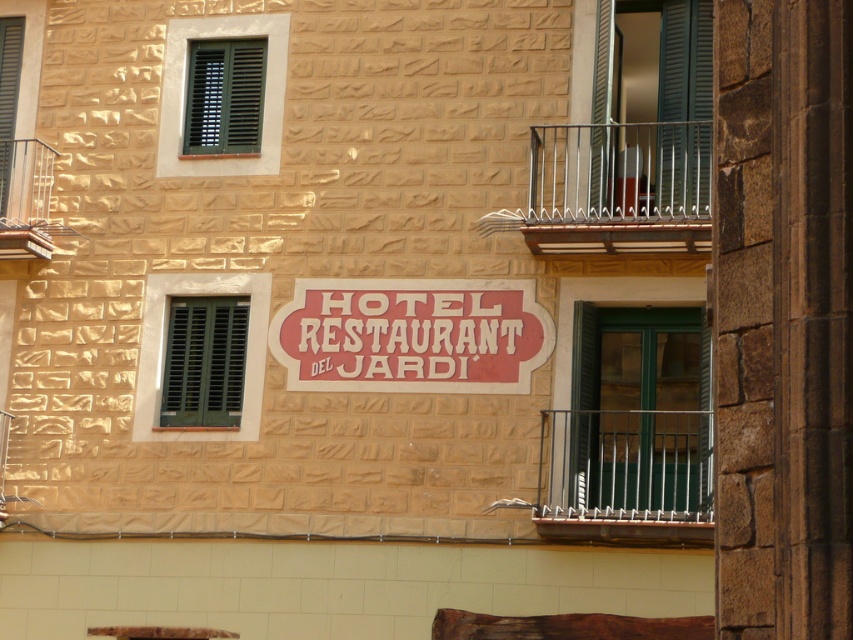
Is polished metal railing at right thinner than green matte shutter at upper left?

In fact, polished metal railing at right might be wider than green matte shutter at upper left.

Measure the distance between point [569,540] and camera.

Point [569,540] and camera are 99.36 feet apart.

Locate an element on the screen. polished metal railing at right is located at coordinates coord(625,476).

Which is below, matte pink sign at center or polished metal railing at right?

Positioned lower is polished metal railing at right.

Does matte pink sign at center appear under polished metal railing at right?

Actually, matte pink sign at center is above polished metal railing at right.

Is point (405, 308) more distant than point (650, 534)?

Yes, point (405, 308) is farther from viewer.

At what (x,y) coordinates should I click in order to perform the action: click on matte pink sign at center. Please return your answer as a coordinate pair (x, y). Looking at the image, I should click on (410, 336).

Is green matte shutter at upper left taller than silver metallic railing at upper left?

Incorrect, green matte shutter at upper left's height is not larger of silver metallic railing at upper left's.

Can you confirm if green matte shutter at upper left is shorter than silver metallic railing at upper left?

Correct, green matte shutter at upper left is not as tall as silver metallic railing at upper left.

Who is more distant from viewer, [215,108] or [15,148]?

The point [15,148] is more distant.

Identify the location of green matte shutter at upper left. (224, 97).